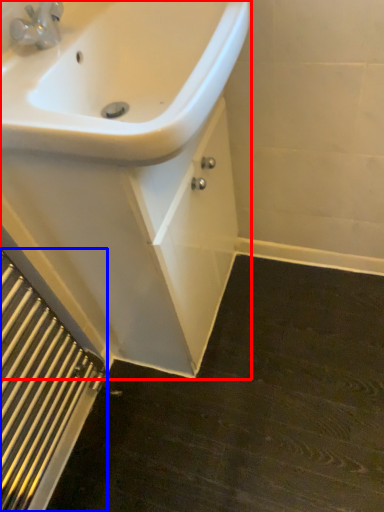
Question: Which of the following is the farthest to the observer, porcelain (highlighted by a red box) or radiator (highlighted by a blue box)?

Choices:
 (A) porcelain
 (B) radiator

Answer: (A)